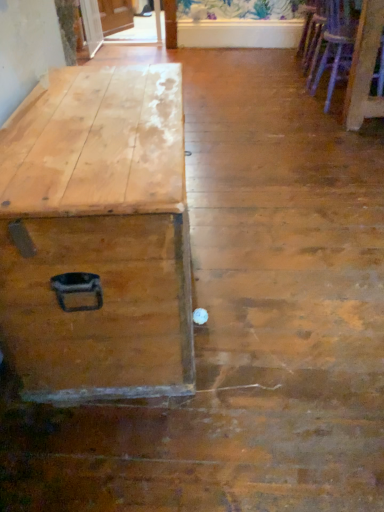
Question: Is natural wood trunk at left far away from wooden armchair at upper right, the second armchair when ordered from bottom to top?

Choices:
 (A) yes
 (B) no

Answer: (A)

Question: Does natural wood trunk at left have a smaller size compared to wooden armchair at upper right, the 1th armchair from the back?

Choices:
 (A) no
 (B) yes

Answer: (A)

Question: From the image's perspective, is natural wood trunk at left beneath wooden armchair at upper right, the first armchair viewed from the top?

Choices:
 (A) no
 (B) yes

Answer: (B)

Question: Can you confirm if natural wood trunk at left is shorter than wooden armchair at upper right, the second armchair when ordered from bottom to top?

Choices:
 (A) no
 (B) yes

Answer: (A)

Question: From a real-world perspective, is natural wood trunk at left beneath wooden armchair at upper right, the 2th armchair when ordered from front to back?

Choices:
 (A) no
 (B) yes

Answer: (A)

Question: Based on their positions, is wooden armchair at right, which is the second armchair in back-to-front order, located to the left or right of natural wood trunk at left?

Choices:
 (A) left
 (B) right

Answer: (B)

Question: In terms of height, does wooden armchair at right, which is the second armchair in back-to-front order, look taller or shorter compared to natural wood trunk at left?

Choices:
 (A) tall
 (B) short

Answer: (A)

Question: Considering their positions, is wooden armchair at right, positioned as the first armchair in bottom-to-top order, located in front of or behind natural wood trunk at left?

Choices:
 (A) behind
 (B) front

Answer: (A)

Question: From a real-world perspective, is wooden armchair at right, arranged as the 2th armchair when viewed from the top, physically located above or below natural wood trunk at left?

Choices:
 (A) below
 (B) above

Answer: (B)

Question: Relative to natural wood trunk at left, is wooden armchair at upper right, the first armchair viewed from the top, in front or behind?

Choices:
 (A) behind
 (B) front

Answer: (A)

Question: From the image's perspective, is wooden armchair at upper right, the first armchair viewed from the top, above or below natural wood trunk at left?

Choices:
 (A) above
 (B) below

Answer: (A)

Question: Is point (312, 74) positioned closer to the camera than point (142, 174)?

Choices:
 (A) farther
 (B) closer

Answer: (A)

Question: Do you think wooden armchair at upper right, the 2th armchair when ordered from front to back, is within natural wood trunk at left, or outside of it?

Choices:
 (A) outside
 (B) inside

Answer: (A)

Question: Based on their positions, is natural wood trunk at left located to the left or right of wooden armchair at upper right, the first armchair viewed from the top?

Choices:
 (A) left
 (B) right

Answer: (A)

Question: From a real-world perspective, relative to wooden armchair at upper right, the first armchair viewed from the top, is natural wood trunk at left vertically above or below?

Choices:
 (A) below
 (B) above

Answer: (B)